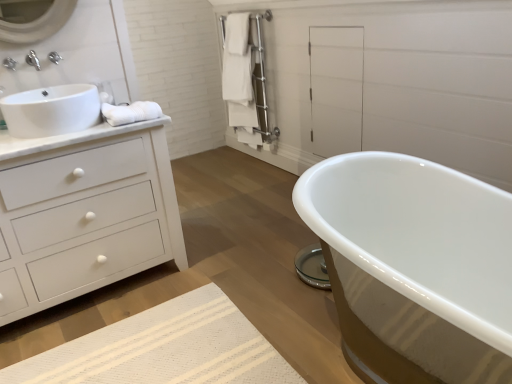
In order to click on white glossy sink at left in this screenshot , I will do `click(51, 110)`.

This screenshot has height=384, width=512. What do you see at coordinates (246, 79) in the screenshot?
I see `satin nickel towel rack at upper center` at bounding box center [246, 79].

I want to click on brushed metal faucet at upper left, which ranks as the 1th faucet in right-to-left order, so click(54, 57).

Describe the element at coordinates (336, 89) in the screenshot. This screenshot has width=512, height=384. I see `white matte cabinet at upper center` at that location.

Where is `white towel at left`? The width and height of the screenshot is (512, 384). white towel at left is located at coordinates (131, 112).

The image size is (512, 384). Describe the element at coordinates (33, 60) in the screenshot. I see `brushed metal faucet at upper left` at that location.

Find the location of a particular element. This screenshot has height=384, width=512. white glossy sink at left is located at coordinates (51, 110).

Considering the relative sizes of brushed metal faucet at upper left, which is the 2th faucet from front to back, and white matte cabinet at upper center in the image provided, is brushed metal faucet at upper left, which is the 2th faucet from front to back, shorter than white matte cabinet at upper center?

Indeed, brushed metal faucet at upper left, which is the 2th faucet from front to back, has a lesser height compared to white matte cabinet at upper center.

In the scene shown: Which is behind, brushed metal faucet at upper left, which ranks as the 1th faucet in right-to-left order, or white matte cabinet at upper center?

white matte cabinet at upper center is behind.

Considering the relative sizes of brushed metal faucet at upper left, which is counted as the 2th faucet, starting from the left, and white matte cabinet at upper center in the image provided, is brushed metal faucet at upper left, which is counted as the 2th faucet, starting from the left, wider than white matte cabinet at upper center?

Yes.

Image resolution: width=512 pixels, height=384 pixels. I want to click on screen door behind the brushed metal faucet at upper left, which is the 2th faucet from front to back, so click(336, 89).

Is brushed metal faucet at upper left, which is the 1th faucet from front to back, to the left or to the right of white matte cabinet at upper center in the image?

From the image, it's evident that brushed metal faucet at upper left, which is the 1th faucet from front to back, is to the left of white matte cabinet at upper center.

Which is correct: brushed metal faucet at upper left, acting as the 2th faucet starting from the right, is inside white matte cabinet at upper center, or outside of it?

brushed metal faucet at upper left, acting as the 2th faucet starting from the right, is outside white matte cabinet at upper center.

Is brushed metal faucet at upper left, the 2th faucet viewed from the back, shorter than white matte cabinet at upper center?

Correct, brushed metal faucet at upper left, the 2th faucet viewed from the back, is not as tall as white matte cabinet at upper center.

Considering the positions of objects white matte cabinet at upper center and brushed metal faucet at upper left, which is the 1th faucet from front to back, in the image provided, who is more to the left, white matte cabinet at upper center or brushed metal faucet at upper left, which is the 1th faucet from front to back,?

brushed metal faucet at upper left, which is the 1th faucet from front to back.

Would you say brushed metal faucet at upper left, the 2th faucet viewed from the back, is part of white matte cabinet at upper center's contents?

No, brushed metal faucet at upper left, the 2th faucet viewed from the back, is not a part of white matte cabinet at upper center.

Which is in front, white matte cabinet at upper center or brushed metal faucet at upper left, which is the 1th faucet from front to back?

brushed metal faucet at upper left, which is the 1th faucet from front to back, is in front.

From a real-world perspective, between brushed metal faucet at upper left and white matte chest of drawers at left, who is vertically lower?

white matte chest of drawers at left.

Which of these two, brushed metal faucet at upper left or white matte chest of drawers at left, is smaller?

Smaller between the two is brushed metal faucet at upper left.

Considering the sizes of brushed metal faucet at upper left and white matte chest of drawers at left in the image, is brushed metal faucet at upper left taller or shorter than white matte chest of drawers at left?

Clearly, brushed metal faucet at upper left is shorter compared to white matte chest of drawers at left.

Does brushed metal faucet at upper left come in front of white matte chest of drawers at left?

No, it is behind white matte chest of drawers at left.

Is brushed metal faucet at upper left, the 1th faucet viewed from the back, positioned beyond the bounds of brushed metal faucet at upper left, which is the 1th faucet from front to back?

brushed metal faucet at upper left, the 1th faucet viewed from the back, is positioned outside brushed metal faucet at upper left, which is the 1th faucet from front to back.

Who is shorter, brushed metal faucet at upper left, which is counted as the 2th faucet, starting from the left, or brushed metal faucet at upper left, which is the 1th faucet from front to back?

brushed metal faucet at upper left, which is counted as the 2th faucet, starting from the left, is shorter.

Which object is positioned more to the right, brushed metal faucet at upper left, which is counted as the 2th faucet, starting from the left, or brushed metal faucet at upper left, the 2th faucet viewed from the back?

brushed metal faucet at upper left, which is counted as the 2th faucet, starting from the left.

Does brushed metal faucet at upper left, which is counted as the 2th faucet, starting from the left, have a lesser height compared to brushed metal faucet at upper left?

Yes, brushed metal faucet at upper left, which is counted as the 2th faucet, starting from the left, is shorter than brushed metal faucet at upper left.

Does point (51, 53) lie in front of point (34, 53)?

No, (51, 53) is further to viewer.

Can you confirm if brushed metal faucet at upper left, which is the 2th faucet from front to back, is thinner than brushed metal faucet at upper left?

Yes, brushed metal faucet at upper left, which is the 2th faucet from front to back, is thinner than brushed metal faucet at upper left.

Is brushed metal faucet at upper left, the 1th faucet viewed from the back, behind brushed metal faucet at upper left?

Yes, the depth of brushed metal faucet at upper left, the 1th faucet viewed from the back, is greater than that of brushed metal faucet at upper left.

Does point (231, 120) appear closer or farther from the camera than point (56, 59)?

Clearly, point (231, 120) is more distant from the camera than point (56, 59).

Between satin nickel towel rack at upper center and brushed metal faucet at upper left, which is the 2th faucet from front to back, which one has smaller size?

With smaller size is brushed metal faucet at upper left, which is the 2th faucet from front to back.

Which of these two, satin nickel towel rack at upper center or brushed metal faucet at upper left, which is counted as the 2th faucet, starting from the left, stands taller?

satin nickel towel rack at upper center.

The height and width of the screenshot is (384, 512). Identify the location of screen door beneath the brushed metal faucet at upper left, which is counted as the 2th faucet, starting from the left (from a real-world perspective). (336, 89).

This screenshot has width=512, height=384. Find the location of `screen door that is above the brushed metal faucet at upper left, which ranks as the first faucet in left-to-right order (from the image's perspective)`. screen door that is above the brushed metal faucet at upper left, which ranks as the first faucet in left-to-right order (from the image's perspective) is located at coordinates (336, 89).

Based on their spatial positions, is white glossy sink at left or brushed metal faucet at upper left, the 2th faucet viewed from the back, closer to white towel at left?

Based on the image, white glossy sink at left appears to be nearer to white towel at left.

Which object lies further to the anchor point white matte cabinet at upper center, brushed metal faucet at upper left, which is counted as the 2th faucet, starting from the left, or white matte chest of drawers at left?

brushed metal faucet at upper left, which is counted as the 2th faucet, starting from the left, lies further to white matte cabinet at upper center than the other object.

Looking at the image, which one is located closer to white glossy sink at left, brushed metal faucet at upper left or white matte chest of drawers at left?

Based on the image, white matte chest of drawers at left appears to be nearer to white glossy sink at left.

Based on their spatial positions, is white glossy sink at left or white matte cabinet at upper center closer to white matte chest of drawers at left?

Based on the image, white glossy sink at left appears to be nearer to white matte chest of drawers at left.

Considering their positions, is white towel at left positioned closer to satin nickel towel rack at upper center than brushed metal faucet at upper left?

Among the two, white towel at left is located nearer to satin nickel towel rack at upper center.

Estimate the real-world distances between objects in this image. Which object is further from white matte chest of drawers at left, satin nickel towel rack at upper center or white towel at left?

satin nickel towel rack at upper center lies further to white matte chest of drawers at left than the other object.

Based on their spatial positions, is white matte chest of drawers at left or white matte cabinet at upper center closer to white towel at left?

The object closer to white towel at left is white matte chest of drawers at left.

Considering their positions, is white towel at left positioned closer to white matte cabinet at upper center than white glossy sink at left?

The object closer to white matte cabinet at upper center is white towel at left.

Where is `closet between white glossy sink at left and white matte cabinet at upper center from left to right`? closet between white glossy sink at left and white matte cabinet at upper center from left to right is located at coordinates (246, 79).

The image size is (512, 384). I want to click on sink that lies between white towel at left and white matte chest of drawers at left from top to bottom, so click(x=51, y=110).

Where is `sink between brushed metal faucet at upper left, the 2th faucet viewed from the back, and white matte cabinet at upper center from left to right`? sink between brushed metal faucet at upper left, the 2th faucet viewed from the back, and white matte cabinet at upper center from left to right is located at coordinates (51, 110).

The image size is (512, 384). I want to click on closet situated between brushed metal faucet at upper left and white matte cabinet at upper center from left to right, so click(246, 79).